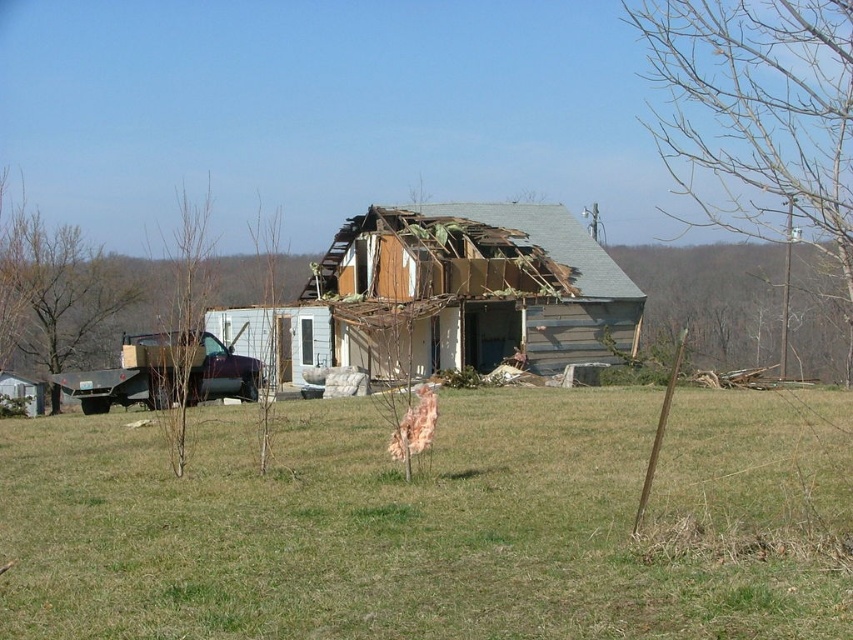
Question: Which object appears farthest from the camera in this image?

Choices:
 (A) green grass at center
 (B) wooden house at center

Answer: (B)

Question: Does green grass at center lie behind wooden house at center?

Choices:
 (A) yes
 (B) no

Answer: (B)

Question: Does green grass at center appear under wooden house at center?

Choices:
 (A) yes
 (B) no

Answer: (A)

Question: Which point is farther from the camera taking this photo?

Choices:
 (A) (432, 243)
 (B) (375, 592)

Answer: (A)

Question: Which object appears closest to the camera in this image?

Choices:
 (A) green grass at center
 (B) wooden house at center

Answer: (A)

Question: Does green grass at center have a smaller size compared to wooden house at center?

Choices:
 (A) no
 (B) yes

Answer: (B)